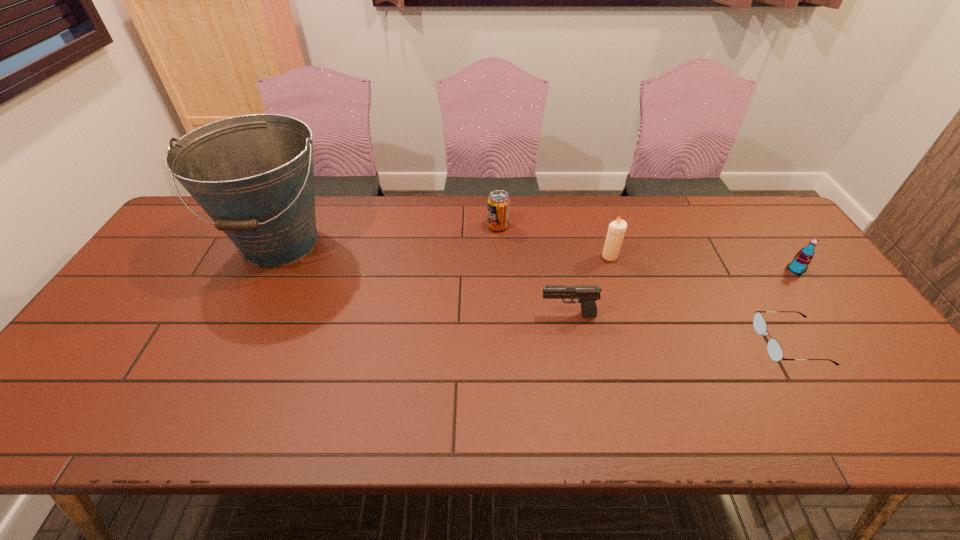
Identify the location of the tallest object. This screenshot has height=540, width=960. (253, 175).

I want to click on the leftmost object, so click(x=253, y=175).

This screenshot has height=540, width=960. In order to click on the fifth shortest object in this screenshot , I will do `click(616, 229)`.

The height and width of the screenshot is (540, 960). Identify the location of the third object from right to left. (616, 229).

Image resolution: width=960 pixels, height=540 pixels. What are the coordinates of `the second object from left to right` in the screenshot? It's located at (498, 204).

This screenshot has height=540, width=960. I want to click on the left soda, so click(x=498, y=204).

Locate an element on the screen. This screenshot has height=540, width=960. the nearer soda is located at coordinates (800, 262).

The width and height of the screenshot is (960, 540). Identify the location of the right soda. (800, 262).

Image resolution: width=960 pixels, height=540 pixels. What are the coordinates of `the fifth farthest object` in the screenshot? It's located at (587, 294).

Image resolution: width=960 pixels, height=540 pixels. Find the location of `the fourth object from right to left`. the fourth object from right to left is located at coordinates (587, 294).